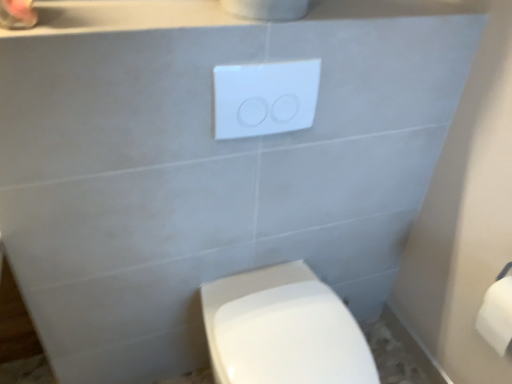
Question: Is white plastic/light switch at upper center smaller than white glossy toilet at lower center?

Choices:
 (A) no
 (B) yes

Answer: (B)

Question: Is white plastic/light switch at upper center further to the viewer compared to white glossy toilet at lower center?

Choices:
 (A) no
 (B) yes

Answer: (B)

Question: Considering the relative sizes of white plastic/light switch at upper center and white glossy toilet at lower center in the image provided, is white plastic/light switch at upper center taller than white glossy toilet at lower center?

Choices:
 (A) yes
 (B) no

Answer: (B)

Question: Would you consider white plastic/light switch at upper center to be distant from white glossy toilet at lower center?

Choices:
 (A) no
 (B) yes

Answer: (A)

Question: Does white plastic/light switch at upper center have a lesser width compared to white glossy toilet at lower center?

Choices:
 (A) no
 (B) yes

Answer: (B)

Question: Considering the relative sizes of white plastic/light switch at upper center and white glossy toilet at lower center in the image provided, is white plastic/light switch at upper center bigger than white glossy toilet at lower center?

Choices:
 (A) yes
 (B) no

Answer: (B)

Question: Considering the relative sizes of white matte toilet paper at right and white glossy toilet at lower center in the image provided, is white matte toilet paper at right smaller than white glossy toilet at lower center?

Choices:
 (A) yes
 (B) no

Answer: (A)

Question: Is white matte toilet paper at right to the left of white glossy toilet at lower center from the viewer's perspective?

Choices:
 (A) no
 (B) yes

Answer: (A)

Question: From a real-world perspective, is white matte toilet paper at right on top of white glossy toilet at lower center?

Choices:
 (A) yes
 (B) no

Answer: (A)

Question: Is white glossy toilet at lower center inside white matte toilet paper at right?

Choices:
 (A) yes
 (B) no

Answer: (B)

Question: Is white matte toilet paper at right further to camera compared to white glossy toilet at lower center?

Choices:
 (A) yes
 (B) no

Answer: (A)

Question: Does white matte toilet paper at right have a lesser width compared to white glossy toilet at lower center?

Choices:
 (A) no
 (B) yes

Answer: (B)

Question: Could you tell me if white matte toilet paper at right is turned towards white plastic/light switch at upper center?

Choices:
 (A) yes
 (B) no

Answer: (B)